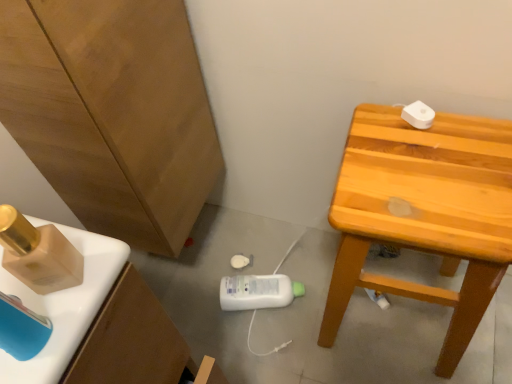
Locate an element on the screen. The image size is (512, 384). matte wood cabinet at left is located at coordinates (112, 113).

Describe the element at coordinates (112, 113) in the screenshot. I see `matte wood cabinet at left` at that location.

The height and width of the screenshot is (384, 512). I want to click on light brown wooden stool at upper right, so click(x=424, y=213).

Describe the element at coordinates (424, 213) in the screenshot. I see `light brown wooden stool at upper right` at that location.

This screenshot has height=384, width=512. I want to click on matte wood cabinet at left, so click(x=112, y=113).

Is matte wood cabinet at left at the left side of light brown wooden stool at upper right?

Correct, you'll find matte wood cabinet at left to the left of light brown wooden stool at upper right.

Which is behind, matte wood cabinet at left or light brown wooden stool at upper right?

Positioned behind is light brown wooden stool at upper right.

Is point (81, 96) farther from camera compared to point (472, 148)?

No, (81, 96) is in front of (472, 148).

From the image's perspective, relative to light brown wooden stool at upper right, is matte wood cabinet at left above or below?

matte wood cabinet at left is above light brown wooden stool at upper right.

From a real-world perspective, is matte wood cabinet at left above or below light brown wooden stool at upper right?

Clearly, from a real-world perspective, matte wood cabinet at left is above light brown wooden stool at upper right.

Does matte wood cabinet at left have a greater width compared to light brown wooden stool at upper right?

Incorrect, the width of matte wood cabinet at left does not surpass that of light brown wooden stool at upper right.

In terms of height, does matte wood cabinet at left look taller or shorter compared to light brown wooden stool at upper right?

matte wood cabinet at left is shorter than light brown wooden stool at upper right.

Considering the sizes of matte wood cabinet at left and light brown wooden stool at upper right in the image, is matte wood cabinet at left bigger or smaller than light brown wooden stool at upper right?

Considering their sizes, matte wood cabinet at left takes up less space than light brown wooden stool at upper right.

Would you say matte wood cabinet at left is outside light brown wooden stool at upper right?

Yes, matte wood cabinet at left is not within light brown wooden stool at upper right.

Does matte wood cabinet at left touch light brown wooden stool at upper right?

No, matte wood cabinet at left is not touching light brown wooden stool at upper right.

Is matte wood cabinet at left facing towards light brown wooden stool at upper right?

Yes.

How different are the orientations of matte wood cabinet at left and light brown wooden stool at upper right in degrees?

The angle between the facing direction of matte wood cabinet at left and the facing direction of light brown wooden stool at upper right is 91.6 degrees.

Where is `stool on the right of matte wood cabinet at left`? Image resolution: width=512 pixels, height=384 pixels. stool on the right of matte wood cabinet at left is located at coordinates [x=424, y=213].

Is light brown wooden stool at upper right at the left side of matte wood cabinet at left?

No, light brown wooden stool at upper right is not to the left of matte wood cabinet at left.

Is light brown wooden stool at upper right in front of matte wood cabinet at left?

No, it is behind matte wood cabinet at left.

Considering the points (360, 278) and (113, 208), which point is behind, point (360, 278) or point (113, 208)?

The point (113, 208) is behind.

From the image's perspective, would you say light brown wooden stool at upper right is shown under matte wood cabinet at left?

Yes, from the image's perspective, light brown wooden stool at upper right is beneath matte wood cabinet at left.

From a real-world perspective, is light brown wooden stool at upper right above or below matte wood cabinet at left?

light brown wooden stool at upper right is below matte wood cabinet at left.

Considering the sizes of light brown wooden stool at upper right and matte wood cabinet at left in the image, is light brown wooden stool at upper right wider or thinner than matte wood cabinet at left?

→ Clearly, light brown wooden stool at upper right has more width compared to matte wood cabinet at left.

Can you confirm if light brown wooden stool at upper right is taller than matte wood cabinet at left?

Correct, light brown wooden stool at upper right is much taller as matte wood cabinet at left.

Which of these two, light brown wooden stool at upper right or matte wood cabinet at left, is smaller?

Smaller between the two is matte wood cabinet at left.

Is light brown wooden stool at upper right outside of matte wood cabinet at left?

light brown wooden stool at upper right is positioned outside matte wood cabinet at left.

Would you consider light brown wooden stool at upper right to be distant from matte wood cabinet at left?

light brown wooden stool at upper right is near matte wood cabinet at left, not far away.

Could you tell me if light brown wooden stool at upper right is facing matte wood cabinet at left?

No, light brown wooden stool at upper right does not turn towards matte wood cabinet at left.

What's the angular difference between light brown wooden stool at upper right and matte wood cabinet at left's facing directions?

They differ by 91.6 degrees in their facing directions.

You are a GUI agent. You are given a task and a screenshot of the screen. Output one action in this format:
    pyautogui.click(x=<x>, y=<y>)
    Task: Click on the stool on the right of matte wood cabinet at left
    Image resolution: width=512 pixels, height=384 pixels.
    Given the screenshot: What is the action you would take?
    pyautogui.click(x=424, y=213)

Locate an element on the screen. This screenshot has width=512, height=384. cabinetry in front of the light brown wooden stool at upper right is located at coordinates (112, 113).

This screenshot has height=384, width=512. There is a light brown wooden stool at upper right. In order to click on cabinetry above it (from a real-world perspective) in this screenshot , I will do `click(112, 113)`.